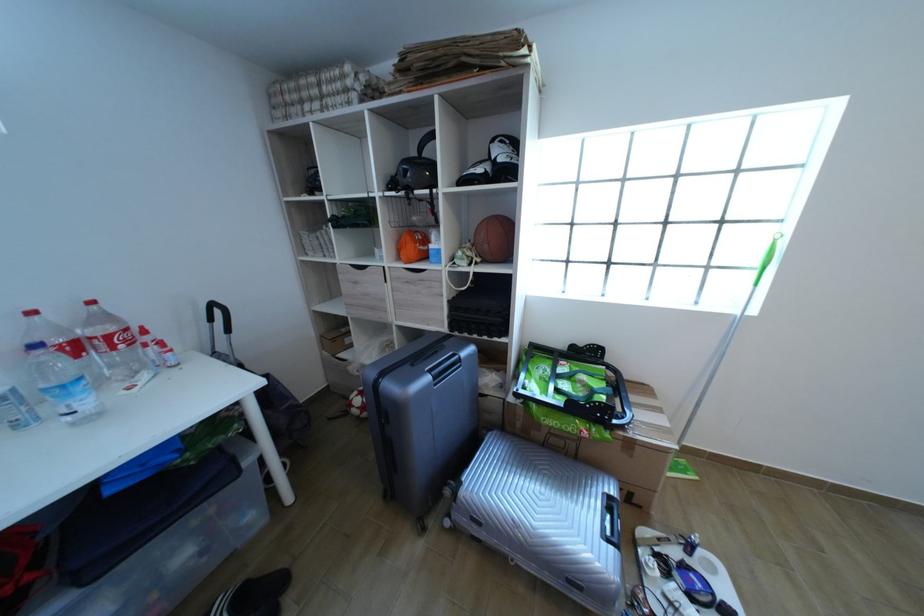
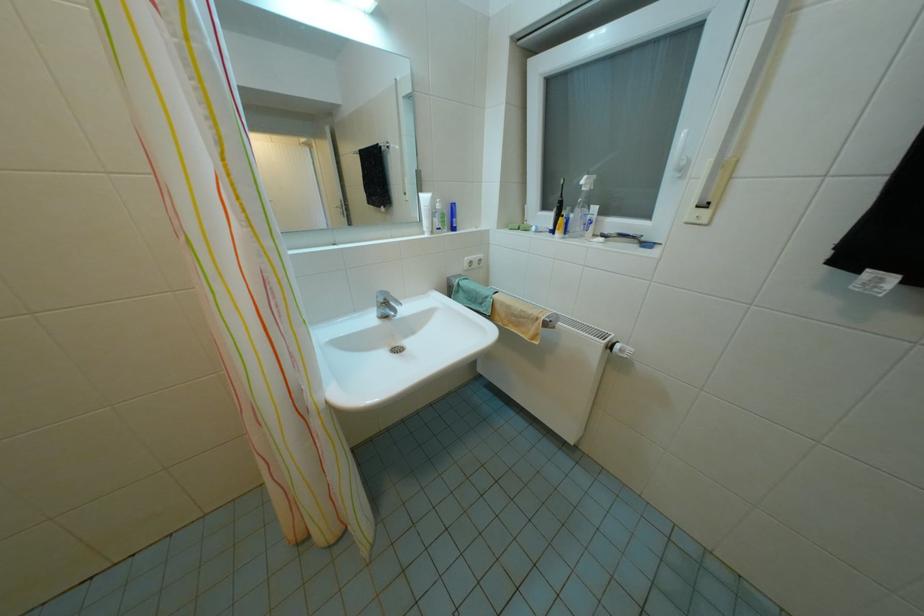
Question: In a continuous first-person perspective shot, in which direction is the camera moving?

Choices:
 (A) Left
 (B) Right
 (C) Forward
 (D) Backward

Answer: (A)